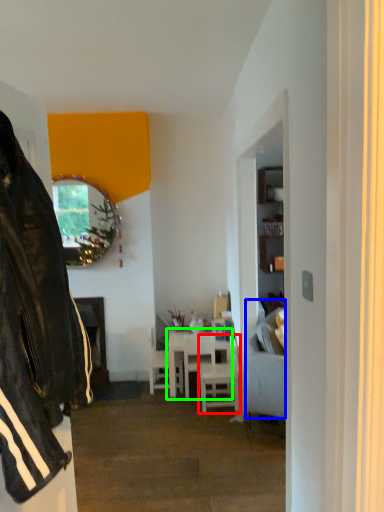
Question: Which is nearer to the chair (highlighted by a red box)? studio couch (highlighted by a blue box) or table (highlighted by a green box).

Choices:
 (A) studio couch
 (B) table

Answer: (B)